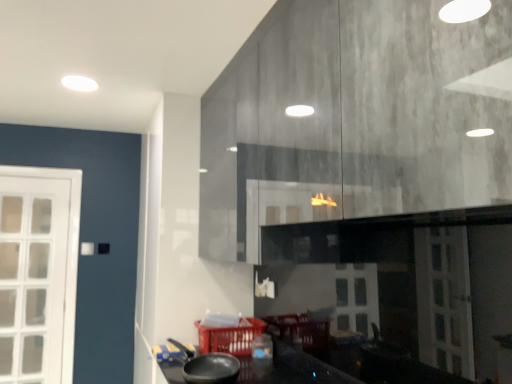
Describe the element at coordinates (230, 337) in the screenshot. The width and height of the screenshot is (512, 384). I see `matte plastic basket at lower center` at that location.

The height and width of the screenshot is (384, 512). Identify the location of matte plastic basket at lower center. (230, 337).

Identify the location of black matte wok at lower center. (208, 367).

The image size is (512, 384). Describe the element at coordinates (208, 367) in the screenshot. I see `black matte wok at lower center` at that location.

You are a GUI agent. You are given a task and a screenshot of the screen. Output one action in this format:
    pyautogui.click(x=<x>, y=<y>)
    Task: Click on the matte plastic basket at lower center
    The width and height of the screenshot is (512, 384).
    Given the screenshot: What is the action you would take?
    pyautogui.click(x=230, y=337)

Considering the positions of objects matte plastic basket at lower center and black matte wok at lower center in the image provided, who is more to the right, matte plastic basket at lower center or black matte wok at lower center?

matte plastic basket at lower center is more to the right.

Considering the relative positions of matte plastic basket at lower center and black matte wok at lower center in the image provided, is matte plastic basket at lower center behind black matte wok at lower center?

Yes, matte plastic basket at lower center is further from the camera.

Does point (248, 318) lie in front of point (211, 378)?

No, (248, 318) is behind (211, 378).

From the image's perspective, who appears lower, matte plastic basket at lower center or black matte wok at lower center?

matte plastic basket at lower center.

From a real-world perspective, between matte plastic basket at lower center and black matte wok at lower center, who is vertically lower?

matte plastic basket at lower center.

Which object is thinner, matte plastic basket at lower center or black matte wok at lower center?

black matte wok at lower center is thinner.

Which of these two, matte plastic basket at lower center or black matte wok at lower center, stands taller?

Standing taller between the two is matte plastic basket at lower center.

Between matte plastic basket at lower center and black matte wok at lower center, which one has smaller size?

black matte wok at lower center.

Do you think matte plastic basket at lower center is within black matte wok at lower center, or outside of it?

matte plastic basket at lower center is not enclosed by black matte wok at lower center.

Can you see matte plastic basket at lower center touching black matte wok at lower center?

They are not placed beside each other.

Is matte plastic basket at lower center facing away from black matte wok at lower center?

That's not correct — matte plastic basket at lower center is not looking away from black matte wok at lower center.

Measure the distance from matte plastic basket at lower center to black matte wok at lower center.

The distance of matte plastic basket at lower center from black matte wok at lower center is 22.09 centimeters.

Where is `wok on the left of matte plastic basket at lower center`? wok on the left of matte plastic basket at lower center is located at coordinates (208, 367).

Which object is positioned more to the left, black matte wok at lower center or matte plastic basket at lower center?

black matte wok at lower center is more to the left.

Relative to matte plastic basket at lower center, is black matte wok at lower center in front or behind?

black matte wok at lower center is positioned closer to the viewer than matte plastic basket at lower center.

Considering the points (193, 359) and (198, 336), which point is in front, point (193, 359) or point (198, 336)?

The point (193, 359) is in front.

From the image's perspective, does black matte wok at lower center appear higher than matte plastic basket at lower center?

Yes, from the image's perspective, black matte wok at lower center is above matte plastic basket at lower center.

Consider the image. From a real-world perspective, is black matte wok at lower center on matte plastic basket at lower center?

Yes, from a real-world perspective, black matte wok at lower center is above matte plastic basket at lower center.

Between black matte wok at lower center and matte plastic basket at lower center, which one has larger width?

With larger width is matte plastic basket at lower center.

In the scene shown: Can you confirm if black matte wok at lower center is shorter than matte plastic basket at lower center?

Indeed, black matte wok at lower center has a lesser height compared to matte plastic basket at lower center.

Which of these two, black matte wok at lower center or matte plastic basket at lower center, is smaller?

black matte wok at lower center.

Do you think black matte wok at lower center is within matte plastic basket at lower center, or outside of it?

black matte wok at lower center is spatially situated outside matte plastic basket at lower center.

Is black matte wok at lower center beside matte plastic basket at lower center?

They are not placed beside each other.

Is black matte wok at lower center positioned with its back to matte plastic basket at lower center?

No, matte plastic basket at lower center is not at the back of black matte wok at lower center.

How distant is black matte wok at lower center from matte plastic basket at lower center?

The distance of black matte wok at lower center from matte plastic basket at lower center is 8.70 inches.

Where is `wok on the left of matte plastic basket at lower center`? wok on the left of matte plastic basket at lower center is located at coordinates (208, 367).

Where is `wok that is above the matte plastic basket at lower center (from the image's perspective)`? The width and height of the screenshot is (512, 384). wok that is above the matte plastic basket at lower center (from the image's perspective) is located at coordinates (208, 367).

At what (x,y) coordinates should I click in order to perform the action: click on wok located in front of the matte plastic basket at lower center. Please return your answer as a coordinate pair (x, y). This screenshot has height=384, width=512. Looking at the image, I should click on (208, 367).